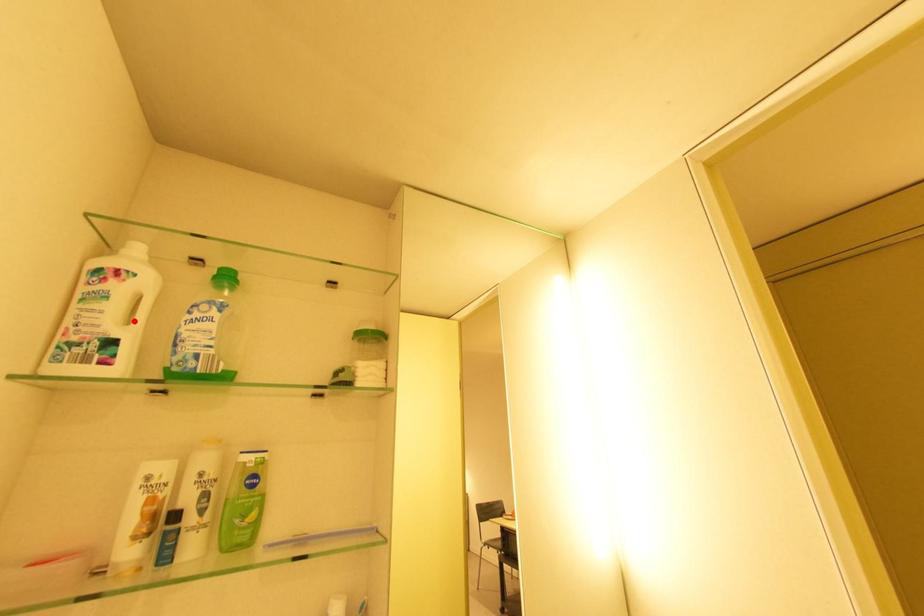
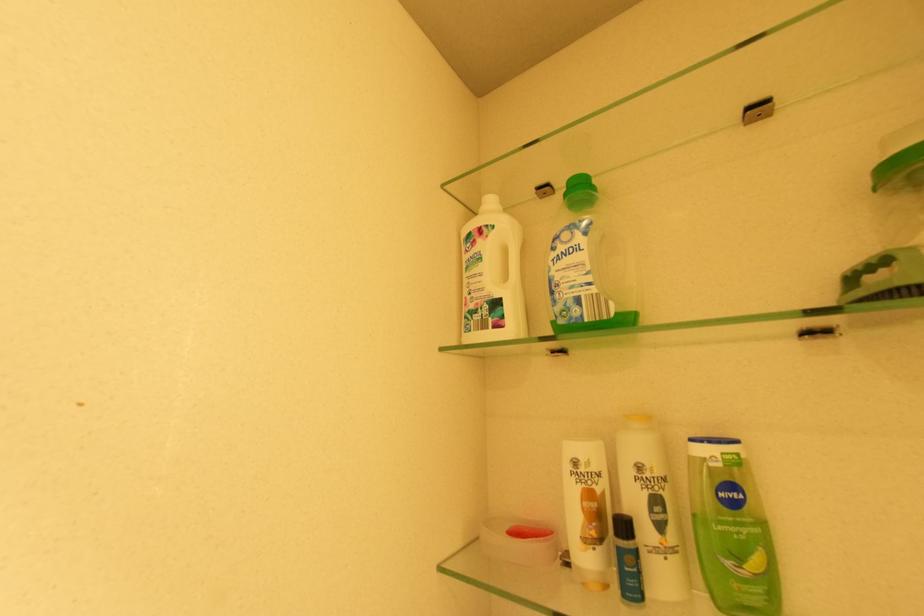
Question: I am providing you with two images of the same scene from different viewpoints. A red point is marked on the first image. Is the red point's position out of view in image 2?

Choices:
 (A) Yes
 (B) No

Answer: (B)